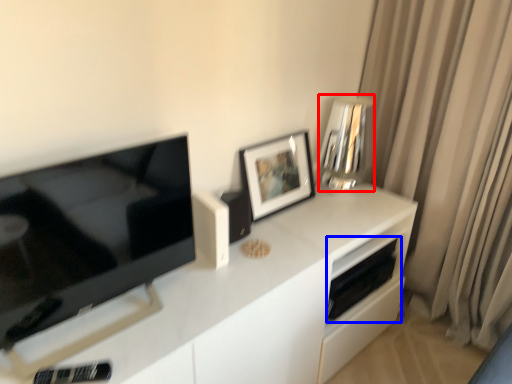
Question: Which object is closer to the camera taking this photo, appliance (highlighted by a red box) or appliance (highlighted by a blue box)?

Choices:
 (A) appliance
 (B) appliance

Answer: (A)